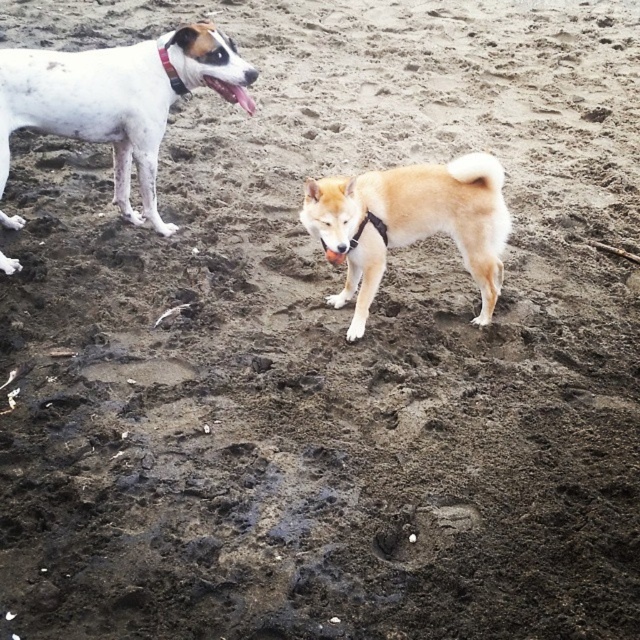
Does point (144, 51) come behind point (300, 218)?

No, it is in front of (300, 218).

Is white fur dog at upper left to the right of light brown fur at center from the viewer's perspective?

In fact, white fur dog at upper left is to the left of light brown fur at center.

This screenshot has height=640, width=640. Identify the location of white fur dog at upper left. (116, 100).

Can you confirm if white fur dog at upper left is thinner than black fabric neckband at upper left?

No.

Does white fur dog at upper left have a larger size compared to black fabric neckband at upper left?

Yes.

In order to click on white fur dog at upper left in this screenshot , I will do `click(116, 100)`.

Find the location of a particular element. The height and width of the screenshot is (640, 640). white fur dog at upper left is located at coordinates (116, 100).

Between light brown fur at center and black fabric neckband at upper left, which one appears on the left side from the viewer's perspective?

From the viewer's perspective, black fabric neckband at upper left appears more on the left side.

Is point (493, 212) positioned after point (179, 83)?

No, it is not.

Where is `light brown fur at center`? light brown fur at center is located at coordinates (410, 224).